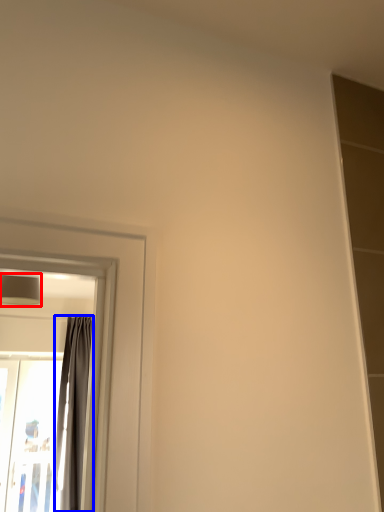
Question: Which object is closer to the camera taking this photo, lamp (highlighted by a red box) or curtain (highlighted by a blue box)?

Choices:
 (A) lamp
 (B) curtain

Answer: (A)